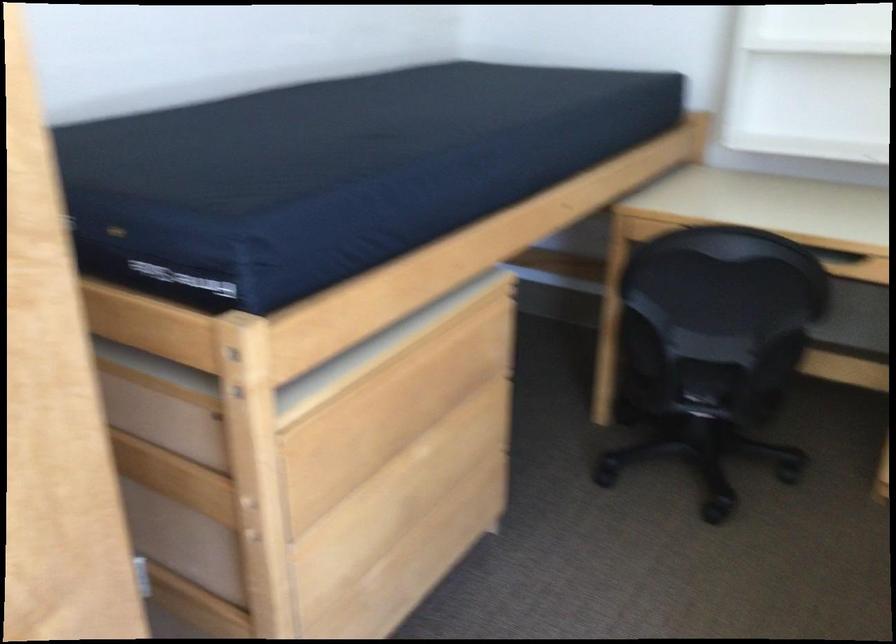
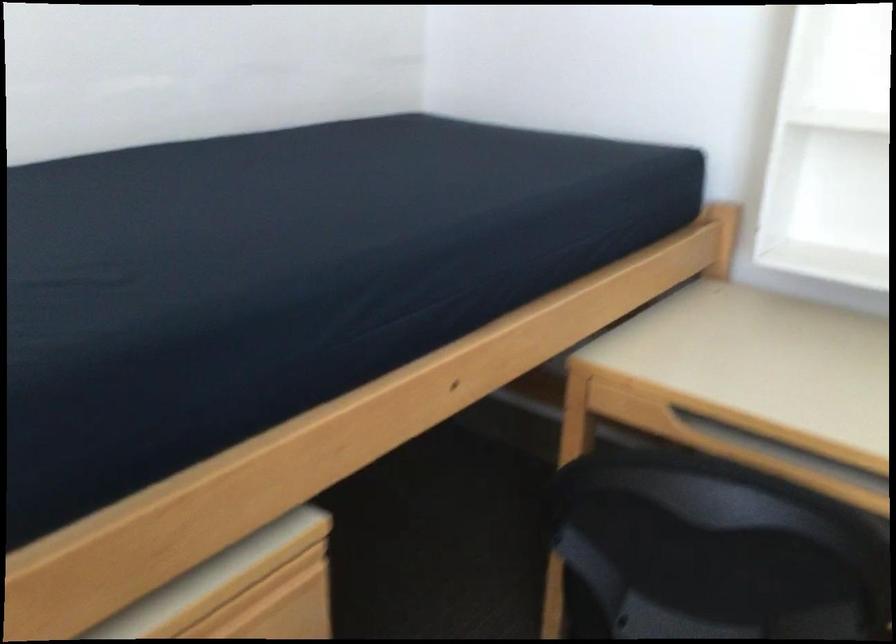
Which direction would the cameraman need to move to produce the second image?

The cameraman walked toward right, forward.